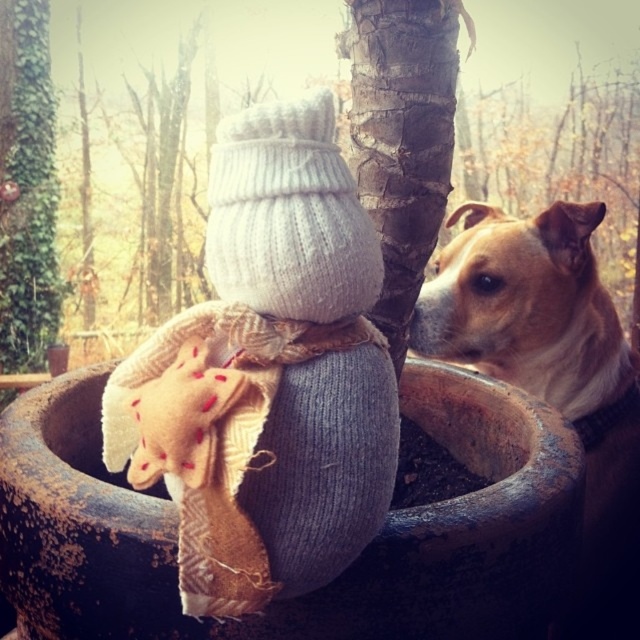
Is brown furry dog at right to the left of smooth bark tree trunk at center from the viewer's perspective?

No, brown furry dog at right is not to the left of smooth bark tree trunk at center.

Who is positioned more to the right, brown furry dog at right or smooth bark tree trunk at center?

brown furry dog at right is more to the right.

Is point (493, 332) positioned after point (422, 189)?

Yes.

This screenshot has width=640, height=640. What are the coordinates of `brown furry dog at right` in the screenshot? It's located at (552, 371).

Who is taller, knitted woolen snowman at center or smooth bark tree trunk at center?

With more height is smooth bark tree trunk at center.

Does knitted woolen snowman at center have a greater width compared to smooth bark tree trunk at center?

Indeed, knitted woolen snowman at center has a greater width compared to smooth bark tree trunk at center.

Between point (298, 317) and point (384, 323), which one is positioned behind?

Positioned behind is point (384, 323).

Where is `knitted woolen snowman at center`? knitted woolen snowman at center is located at coordinates (268, 374).

Who is more distant from viewer, (579, 234) or (20, 337)?

The point (20, 337) is behind.

Who is shorter, brown furry dog at right or green ivy at left?

brown furry dog at right is shorter.

Between point (602, 416) and point (10, 198), which one is positioned behind?

Point (10, 198)

Locate an element on the screen. The width and height of the screenshot is (640, 640). brown furry dog at right is located at coordinates (552, 371).